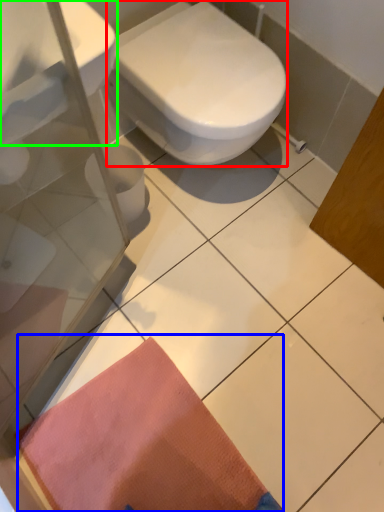
Question: Considering the real-world distances, which object is farthest from bidet (highlighted by a red box)? doormat (highlighted by a blue box) or sink (highlighted by a green box)?

Choices:
 (A) doormat
 (B) sink

Answer: (A)